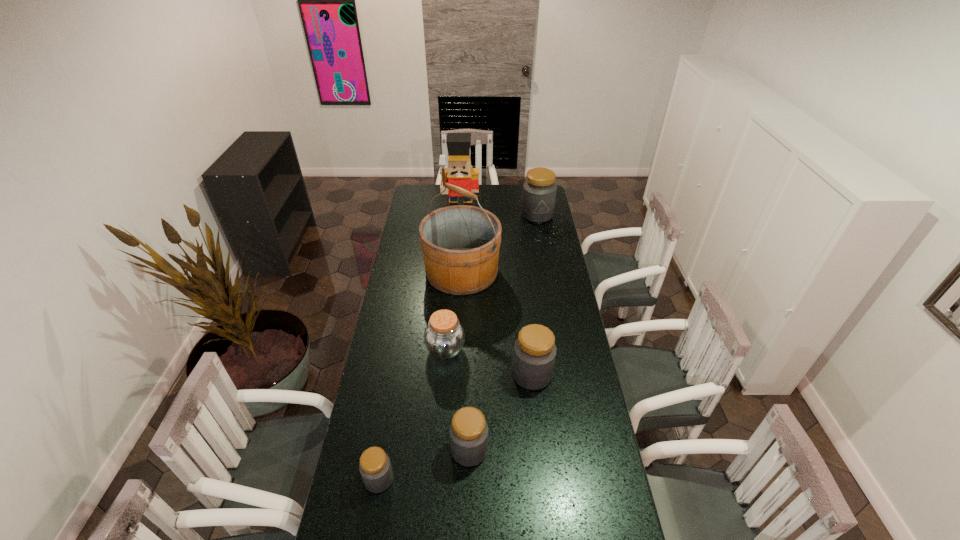
You are a GUI agent. You are given a task and a screenshot of the screen. Output one action in this format:
    pyautogui.click(x=<x>, y=<y>)
    Task: Click on the fifth closest object relative to the brown jar
    This screenshot has width=960, height=540.
    Given the screenshot: What is the action you would take?
    pyautogui.click(x=459, y=172)

Where is `object that is the sixth nearest to the second smallest gray jar`? object that is the sixth nearest to the second smallest gray jar is located at coordinates (539, 191).

Identify which jar is located as the third nearest to the third biggest gray jar. Please provide its 2D coordinates. Your answer should be formatted as a tuple, i.e. [(x, y)], where the tuple contains the x and y coordinates of a point satisfying the conditions above.

[(444, 336)]

Select which jar is the fifth closest to the nutcracker. Please provide its 2D coordinates. Your answer should be formatted as a tuple, i.e. [(x, y)], where the tuple contains the x and y coordinates of a point satisfying the conditions above.

[(375, 468)]

Identify which gray jar is the closest to the tallest jar. Please provide its 2D coordinates. Your answer should be formatted as a tuple, i.e. [(x, y)], where the tuple contains the x and y coordinates of a point satisfying the conditions above.

[(534, 355)]

Locate which gray jar ranks in proximity to the smallest gray jar. Please provide its 2D coordinates. Your answer should be formatted as a tuple, i.e. [(x, y)], where the tuple contains the x and y coordinates of a point satisfying the conditions above.

[(469, 432)]

Locate an element on the screen. This screenshot has height=540, width=960. vacant area that satisfies the following two spatial constraints: 1. on the surface of the biggest gray jar near the warning symbol; 2. on the surface of the leftmost gray jar near the warning symbol is located at coordinates (584, 479).